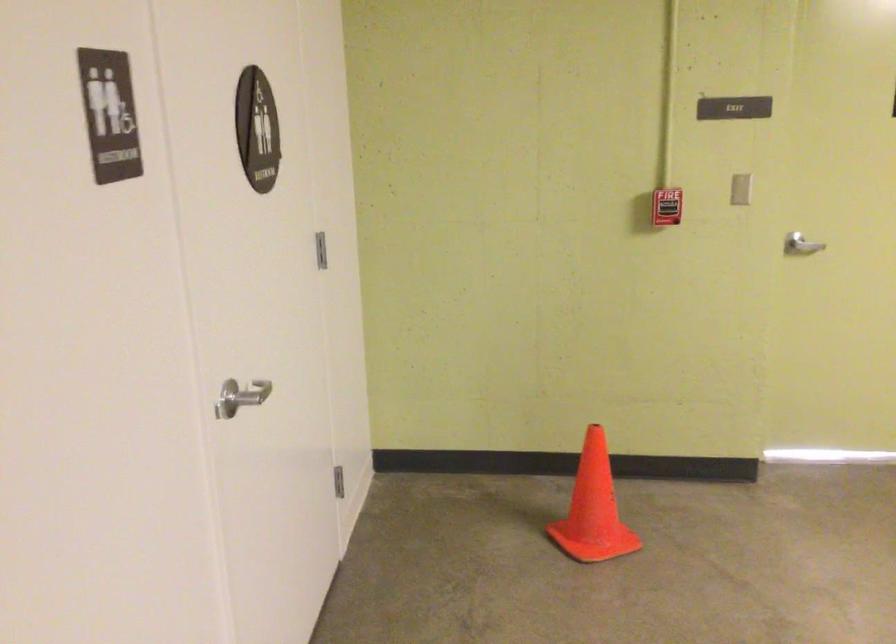
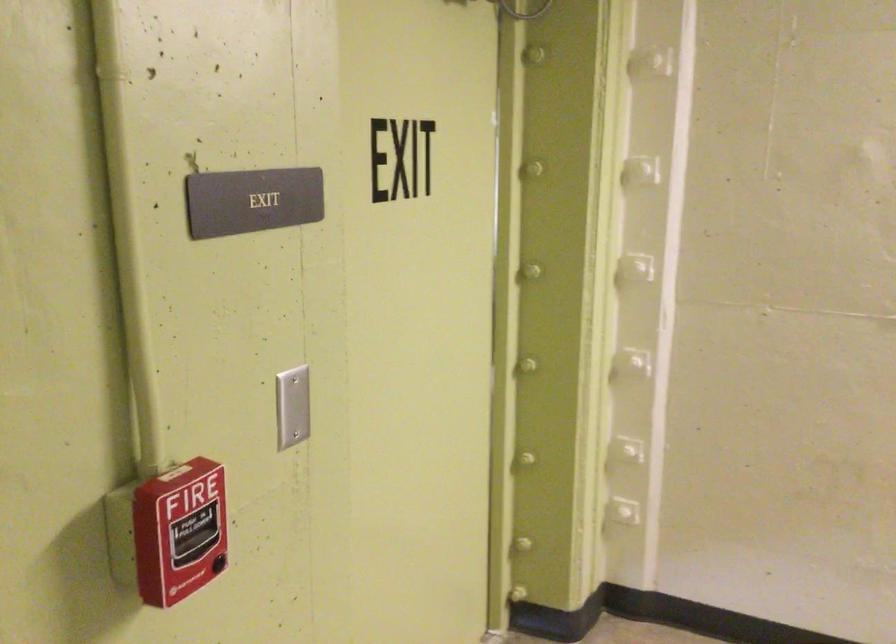
Where in the second image is the point corresponding to (668,220) from the first image?

(179, 532)